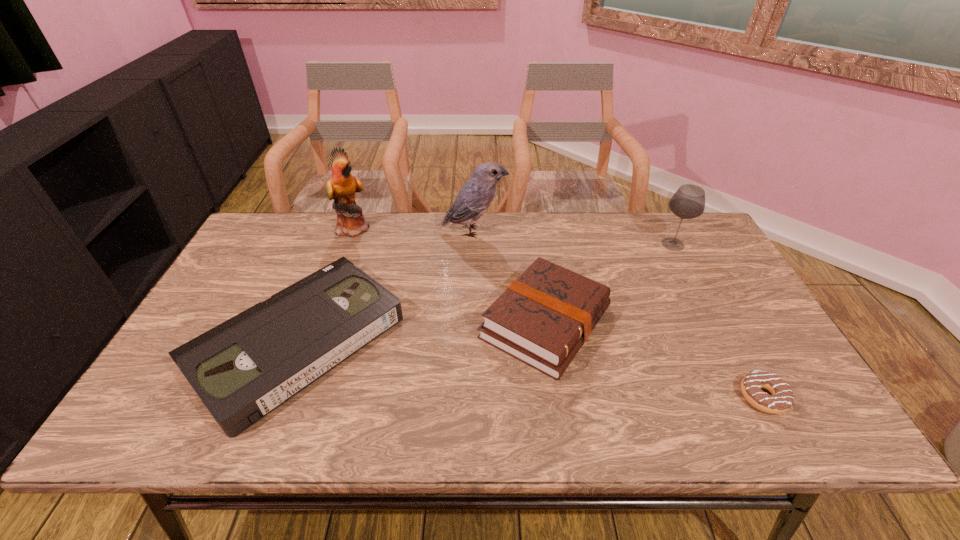
Where is `free space located on the left of the fourth shortest object`? The image size is (960, 540). free space located on the left of the fourth shortest object is located at coordinates pos(629,245).

Find the location of `vacant area located 0.220m on the right of the hardback book`. vacant area located 0.220m on the right of the hardback book is located at coordinates (698, 322).

The image size is (960, 540). What are the coordinates of `vacant space situated on the back of the second shortest object` in the screenshot? It's located at (342, 232).

Where is `free spot located 0.320m on the back of the doughnut`? free spot located 0.320m on the back of the doughnut is located at coordinates (702, 285).

Where is `wineglass at the far edge`? wineglass at the far edge is located at coordinates (688, 202).

The width and height of the screenshot is (960, 540). Identify the location of videotape present at the near edge. (244, 368).

At what (x,y) coordinates should I click in order to perform the action: click on doughnut at the near edge. Please return your answer as a coordinate pair (x, y). The height and width of the screenshot is (540, 960). Looking at the image, I should click on [x=782, y=397].

Identify the location of object positioned at the left edge. click(244, 368).

Locate an element on the screen. The width and height of the screenshot is (960, 540). wineglass that is at the right edge is located at coordinates (688, 202).

The width and height of the screenshot is (960, 540). In order to click on doughnut that is at the right edge in this screenshot , I will do `click(782, 397)`.